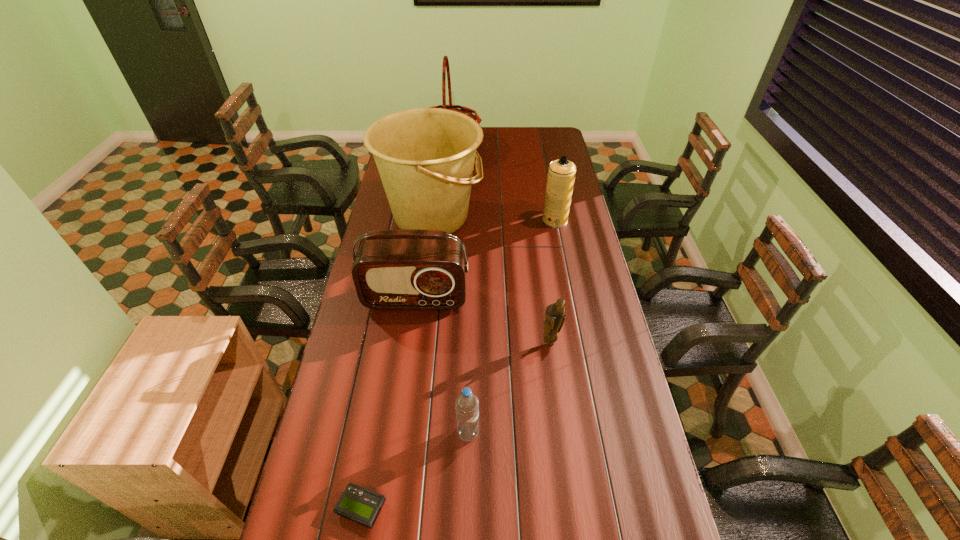
Image resolution: width=960 pixels, height=540 pixels. What are the coordinates of `free spot located on the side of the bucket with the handle` in the screenshot? It's located at (558, 217).

Identify the location of free region located on the front panel of the fourth nearest object. (402, 393).

At what (x,y) coordinates should I click in order to perform the action: click on vacant area situated 0.380m on the left of the aerosol can. Please return your answer as a coordinate pair (x, y). The width and height of the screenshot is (960, 540). Looking at the image, I should click on (455, 220).

Identify the location of vacant space located on the back of the water bottle. This screenshot has width=960, height=540. (470, 315).

The image size is (960, 540). I want to click on vacant space situated 0.200m on the front-facing side of the figurine, so click(559, 402).

Find the location of a particular element. The height and width of the screenshot is (540, 960). free space located 0.220m on the right of the nearest object is located at coordinates (474, 508).

Locate an element on the screen. This screenshot has height=540, width=960. object that is at the far edge is located at coordinates (445, 67).

Identify the location of basket that is at the left edge. This screenshot has height=540, width=960. (445, 67).

At what (x,y) coordinates should I click in order to perform the action: click on bucket that is at the left edge. Please return your answer as a coordinate pair (x, y). The image size is (960, 540). Looking at the image, I should click on (425, 157).

Find the location of a particular element. The height and width of the screenshot is (540, 960). radio receiver at the left edge is located at coordinates (406, 269).